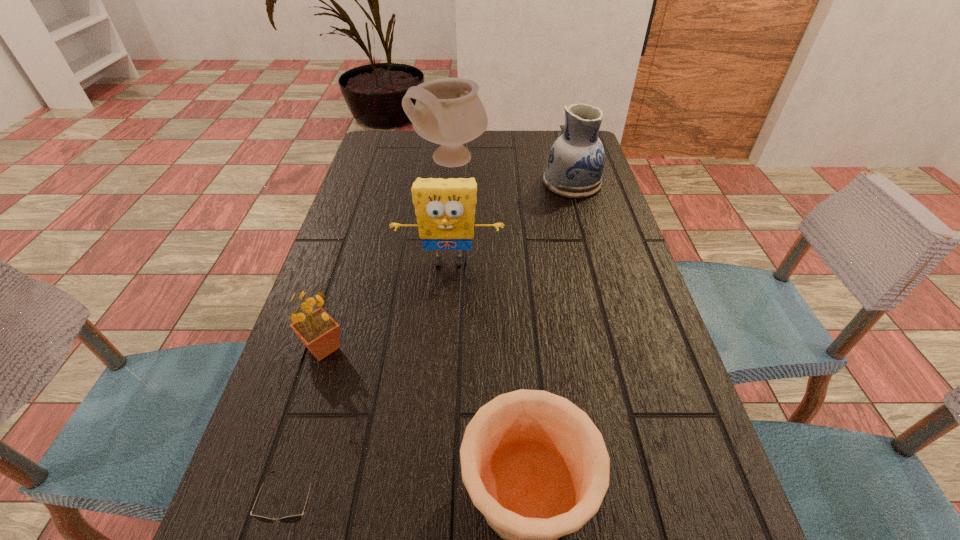
In the image, there is a desktop. Identify the location of vacant space at the right edge. [650, 369].

The width and height of the screenshot is (960, 540). Find the location of `blank space at the far left corner`. blank space at the far left corner is located at coordinates (379, 154).

This screenshot has width=960, height=540. Identify the location of free space at the far right corner of the desktop. (542, 136).

Locate an element on the screen. vacant area between the sponge and the sunglasses is located at coordinates (372, 386).

Image resolution: width=960 pixels, height=540 pixels. I want to click on free area in between the shortest object and the fourth farthest object, so click(x=310, y=429).

Where is `vacant space in between the shortest object and the fourth nearest object`? The image size is (960, 540). vacant space in between the shortest object and the fourth nearest object is located at coordinates (372, 386).

At what (x,y) coordinates should I click in order to perform the action: click on vacant space that's between the sunglasses and the second tallest pottery. Please return your answer as a coordinate pair (x, y). The height and width of the screenshot is (540, 960). Looking at the image, I should click on tap(434, 346).

The height and width of the screenshot is (540, 960). What are the coordinates of `empty location between the third farthest object and the shortest object` in the screenshot? It's located at (372, 386).

Identify the location of blank region between the tallest object and the shortest object. This screenshot has width=960, height=540. (373, 335).

Identify the location of free point between the sunflower and the tallest pottery. (387, 255).